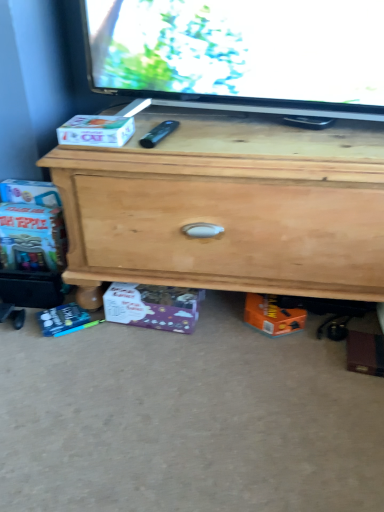
Find the location of a particular element. The width and height of the screenshot is (384, 512). vacant area that is in front of purple cardboard box at lower center, positioned as the 2th box in top-to-bottom order is located at coordinates (145, 360).